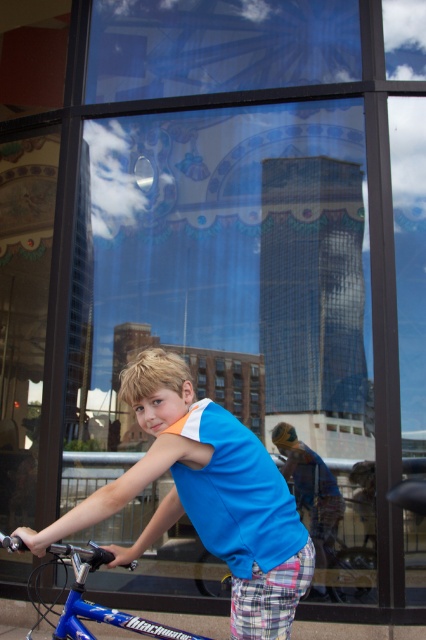
Question: Which object is positioned farthest from the blue metallic bicycle at center?

Choices:
 (A) blue cotton shirt at center
 (B) blue metallic bicycle at lower left

Answer: (A)

Question: Is blue cotton shirt at center behind blue metallic bicycle at center?

Choices:
 (A) no
 (B) yes

Answer: (A)

Question: Which of the following is the farthest from the observer?

Choices:
 (A) blue metallic bicycle at lower left
 (B) blue metallic bicycle at center

Answer: (B)

Question: Estimate the real-world distances between objects in this image. Which object is farther from the blue metallic bicycle at lower left?

Choices:
 (A) blue metallic bicycle at center
 (B) blue cotton shirt at center

Answer: (A)

Question: Can you confirm if blue cotton shirt at center is positioned above blue metallic bicycle at center?

Choices:
 (A) yes
 (B) no

Answer: (A)

Question: Does blue cotton shirt at center appear over blue metallic bicycle at center?

Choices:
 (A) yes
 (B) no

Answer: (A)